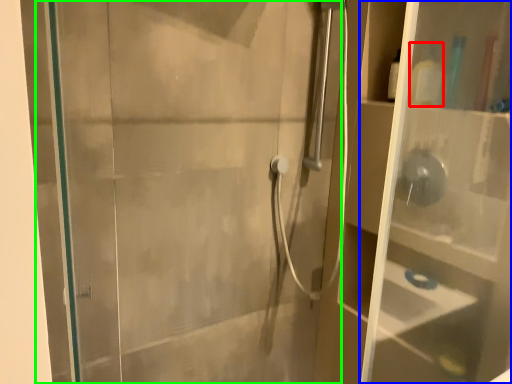
Question: Estimate the real-world distances between objects in this image. Which object is farther from toiletry (highlighted by a red box), glass box (highlighted by a blue box) or screen door (highlighted by a green box)?

Choices:
 (A) glass box
 (B) screen door

Answer: (B)